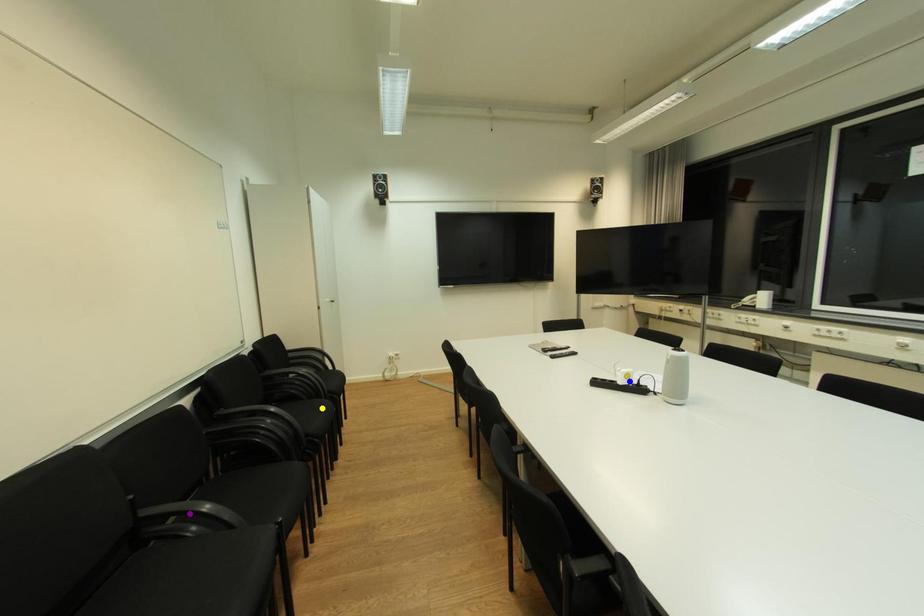
Order these from farthest to nearest:
yellow point, purple point, blue point

yellow point < blue point < purple point